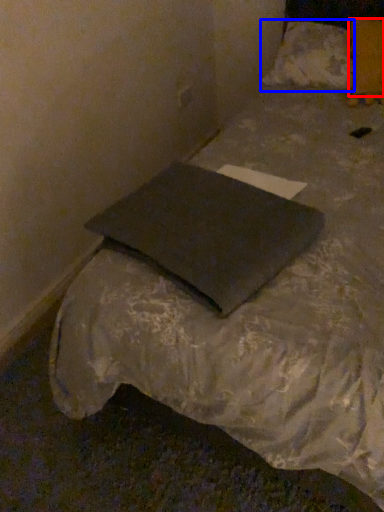
Question: Which object appears farthest to the camera in this image, pillow (highlighted by a red box) or pillow (highlighted by a blue box)?

Choices:
 (A) pillow
 (B) pillow

Answer: (B)